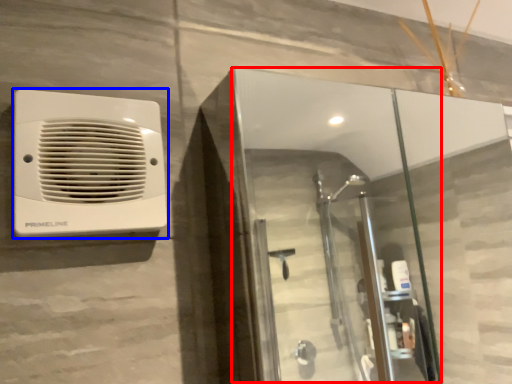
Question: Which point is further to the camera, screen door (highlighted by a red box) or home appliance (highlighted by a blue box)?

Choices:
 (A) screen door
 (B) home appliance

Answer: (B)